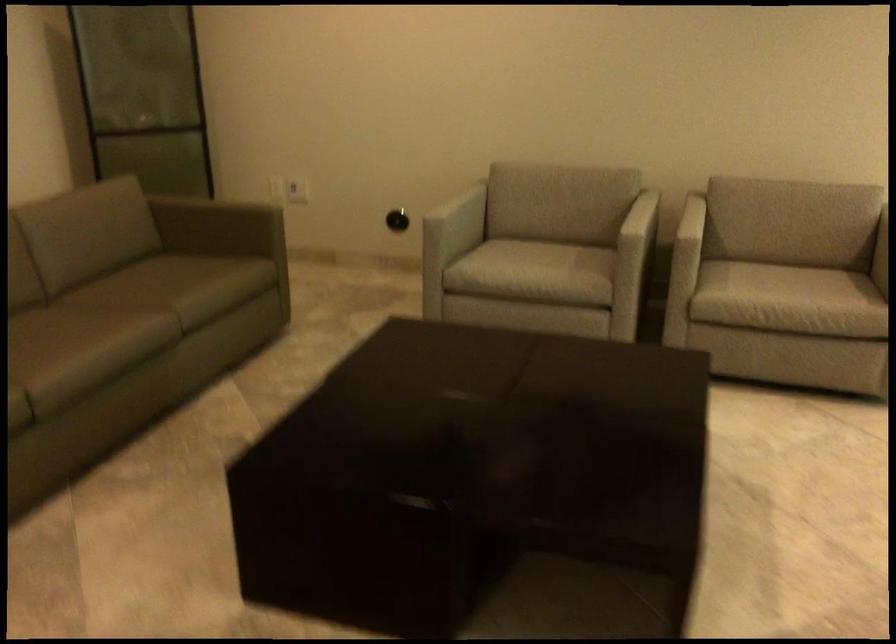
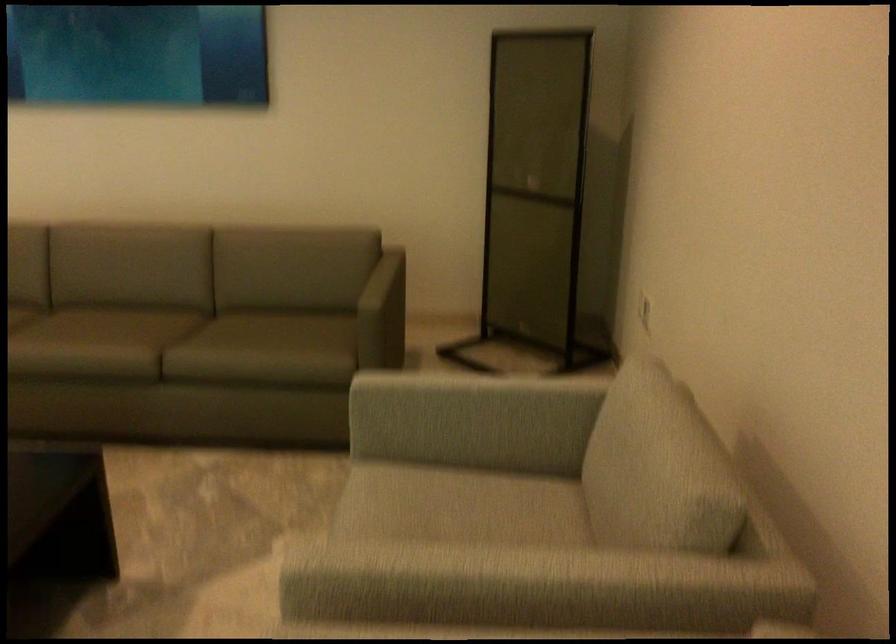
Question: I am providing you with two images of the same scene from different viewpoints. Which of the following objects are not visible in image2?

Choices:
 (A) sofa armrest
 (B) grey sofa cushion
 (C) sofa sitting surface
 (D) none of these

Answer: (D)